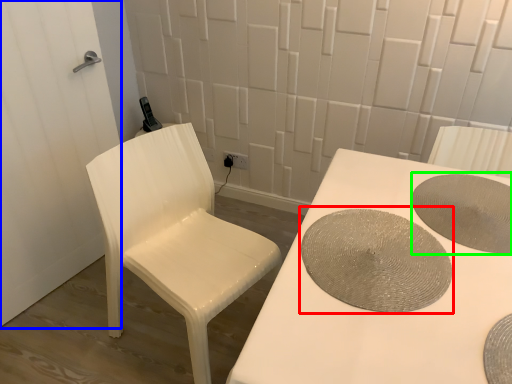
Question: Which object is the closest to the manhole cover (highlighted by a red box)? Choose among these: screen door (highlighted by a blue box) or manhole cover (highlighted by a green box).

Choices:
 (A) screen door
 (B) manhole cover

Answer: (B)